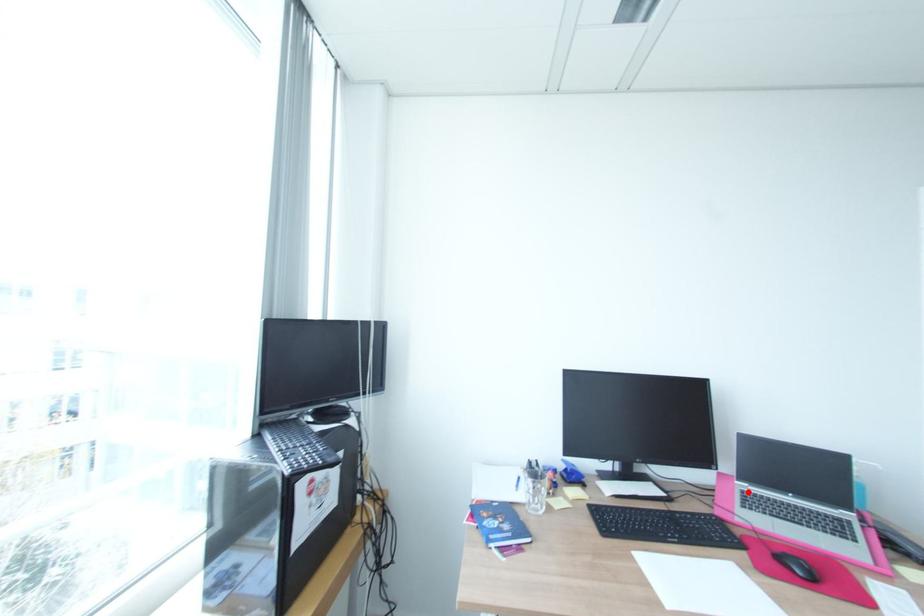
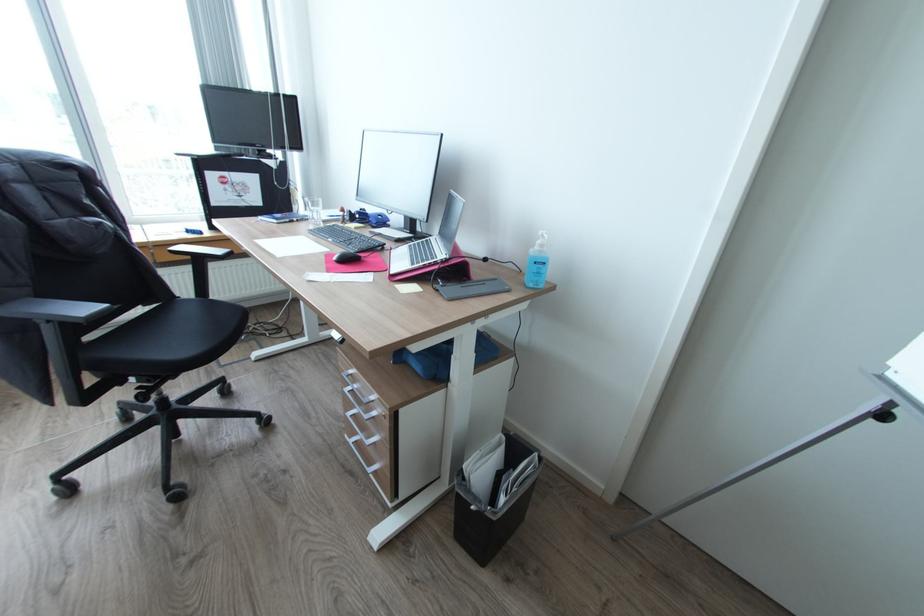
Question: I am providing you with two images of the same scene from different viewpoints. A red point is marked on the first image. Is the red point's position out of view in image 2?

Choices:
 (A) Yes
 (B) No

Answer: (B)